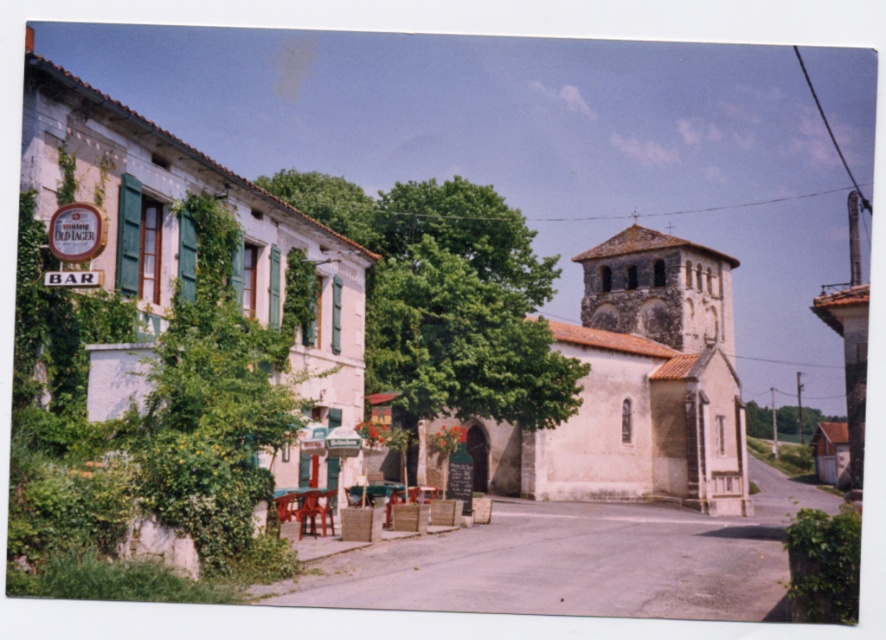
You are a customer looking for a seat in the outdoor area of the BAR. You see a green leafy tree at right and a wooden chair at center. Which object is closer to you? Please answer based on their positions in the image.

The green leafy tree at right is closer to you because it is further to the viewer than the wooden chair at center.